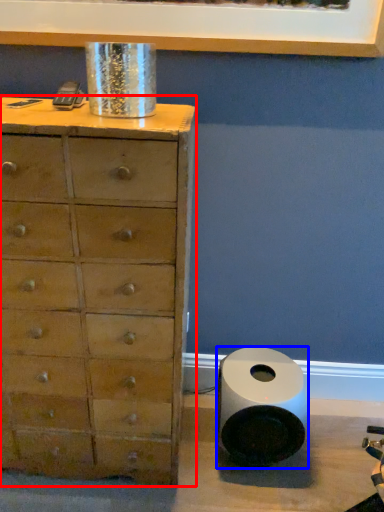
Question: Which object appears closest to the camera in this image, chest of drawers (highlighted by a red box) or speaker (highlighted by a blue box)?

Choices:
 (A) chest of drawers
 (B) speaker

Answer: (A)